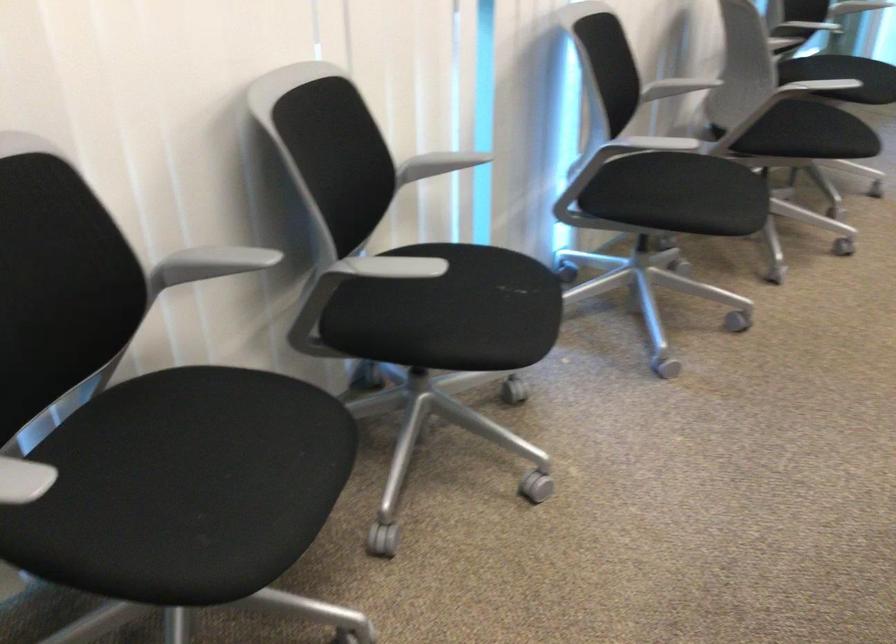
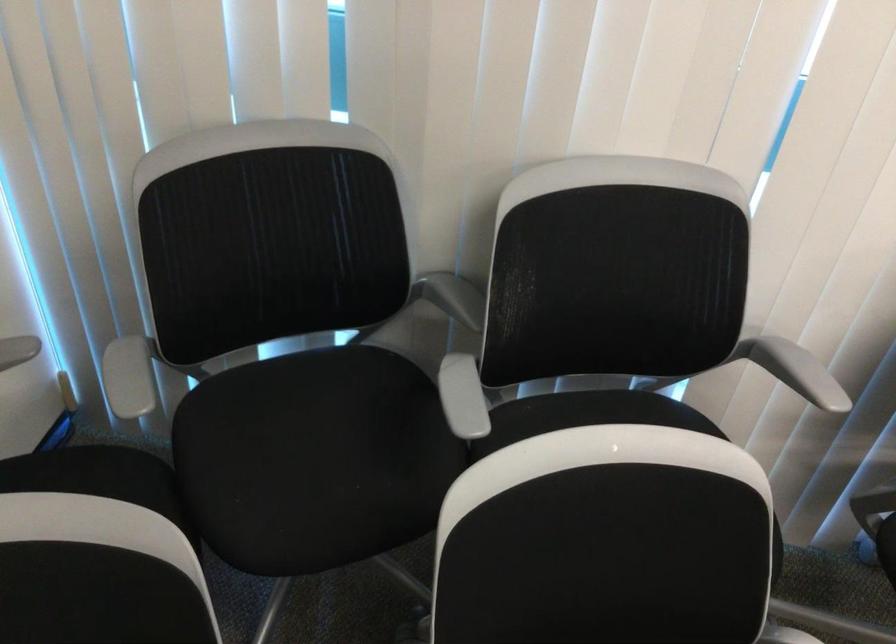
The images are taken continuously from a first-person perspective. In which direction is your viewpoint rotating?

The camera rotated toward left-down.